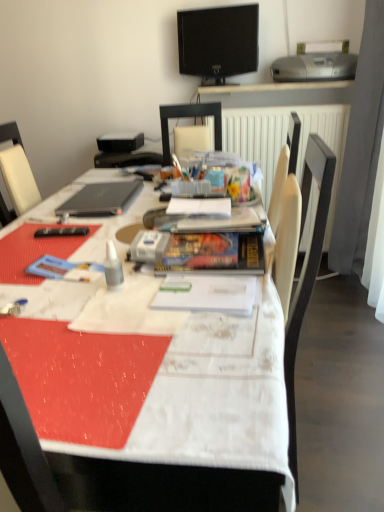
You are a GUI agent. You are given a task and a screenshot of the screen. Output one action in this format:
    pyautogui.click(x=<x>, y=<y>)
    Task: Click on the vacant space in front of hardcover book at center, marked as the 1th paperback book in a bottom-to-top arrangement
    The width and height of the screenshot is (384, 512).
    Given the screenshot: What is the action you would take?
    pyautogui.click(x=198, y=320)